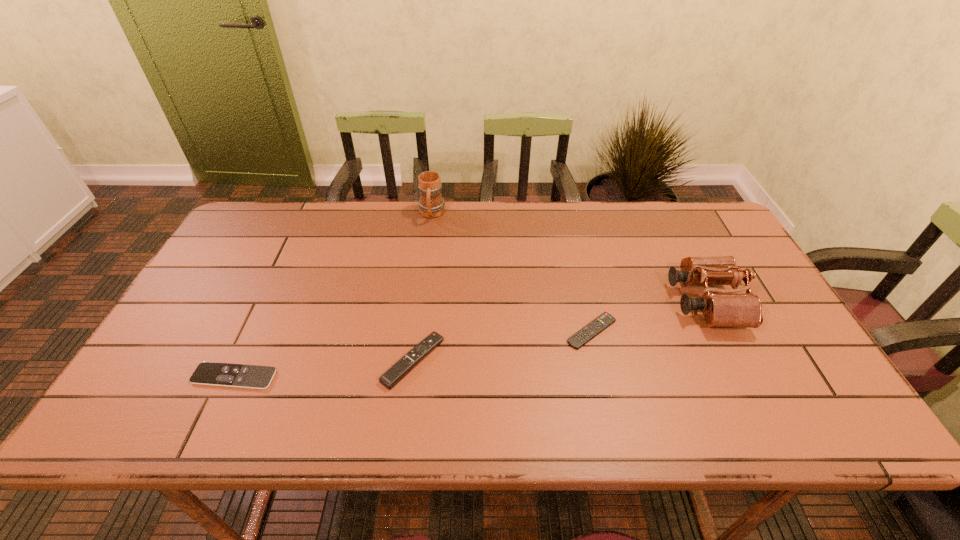
You are a GUI agent. You are given a task and a screenshot of the screen. Output one action in this format:
    pyautogui.click(x=<x>, y=<y>)
    Task: Click on the mug
    This screenshot has width=960, height=540.
    Given the screenshot: What is the action you would take?
    pyautogui.click(x=431, y=204)

Where is `the rightmost object`? the rightmost object is located at coordinates (728, 308).

I want to click on the second remote control from right to left, so [x=402, y=367].

Where is `the third tallest object`? Image resolution: width=960 pixels, height=540 pixels. the third tallest object is located at coordinates click(402, 367).

The height and width of the screenshot is (540, 960). I want to click on the rightmost remote control, so click(580, 338).

At what (x,y) coordinates should I click in order to perform the action: click on the leftmost object. Please return your answer as a coordinate pair (x, y). The image size is (960, 540). Looking at the image, I should click on coord(207,373).

This screenshot has height=540, width=960. Identify the location of vacant space positioned 0.260m on the side of the mug with the handle. (423, 281).

Where is `vacant position located 0.120m through the eyepieces of the rightmost object`? The image size is (960, 540). vacant position located 0.120m through the eyepieces of the rightmost object is located at coordinates (629, 302).

Find the location of a particular element. This screenshot has width=960, height=540. vacant space located 0.120m through the eyepieces of the rightmost object is located at coordinates (629, 302).

At what (x,y) coordinates should I click in order to perform the action: click on vacant space located 0.160m through the eyepieces of the rightmost object. Please return your answer as a coordinate pair (x, y). This screenshot has height=540, width=960. Looking at the image, I should click on (614, 302).